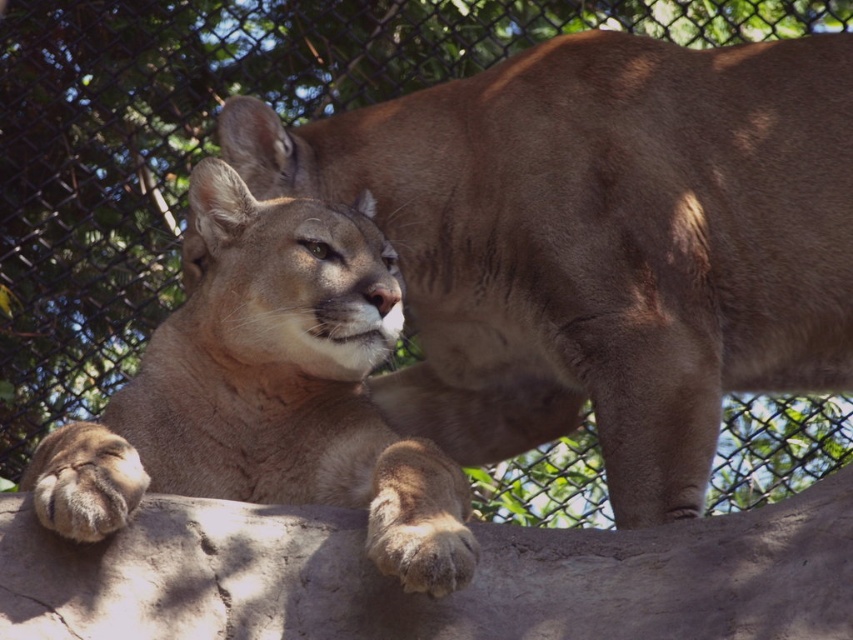
Question: Which point is farther to the camera?

Choices:
 (A) light brown fur cougar at center
 (B) gray rough stone at center

Answer: (B)

Question: Which point is closer to the camera?

Choices:
 (A) (792, 568)
 (B) (105, 442)

Answer: (A)

Question: Is gray rough stone at center wider than light brown fur cougar at center?

Choices:
 (A) yes
 (B) no

Answer: (A)

Question: Does gray rough stone at center lie in front of light brown fur cougar at center?

Choices:
 (A) yes
 (B) no

Answer: (B)

Question: Does gray rough stone at center have a greater width compared to light brown fur cougar at center?

Choices:
 (A) yes
 (B) no

Answer: (A)